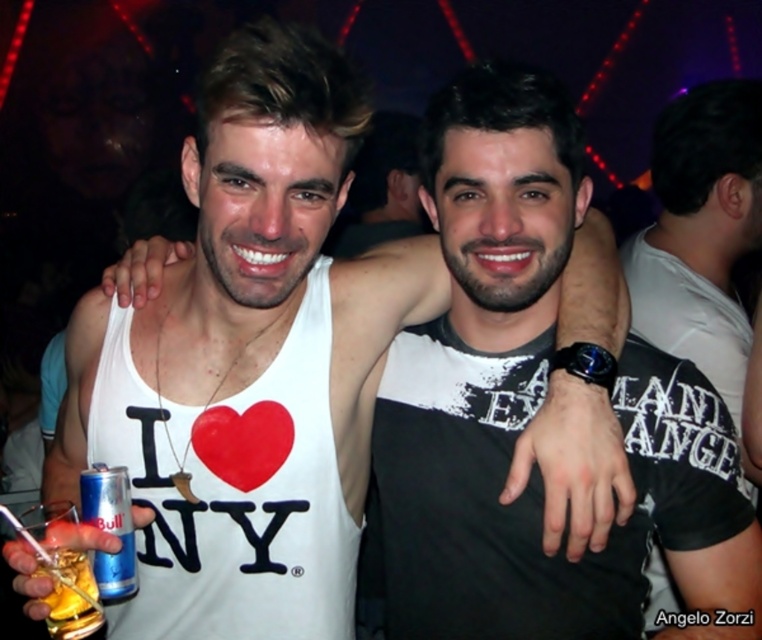
Question: Which of these objects is positioned closest to the black matte tank top at center?

Choices:
 (A) translucent glass at lower left
 (B) blue metallic can at lower left

Answer: (B)

Question: Can you confirm if black matte tank top at center is positioned below translucent glass at lower left?

Choices:
 (A) yes
 (B) no

Answer: (B)

Question: Is black matte tank top at center thinner than blue metallic can at lower left?

Choices:
 (A) yes
 (B) no

Answer: (B)

Question: Does black matte tank top at center have a smaller size compared to translucent glass at lower left?

Choices:
 (A) yes
 (B) no

Answer: (B)

Question: Which object is the closest to the translucent glass at lower left?

Choices:
 (A) black matte tank top at center
 (B) blue metallic can at lower left

Answer: (B)

Question: Which object is positioned closest to the blue metallic can at lower left?

Choices:
 (A) translucent glass at lower left
 (B) black matte tank top at center

Answer: (A)